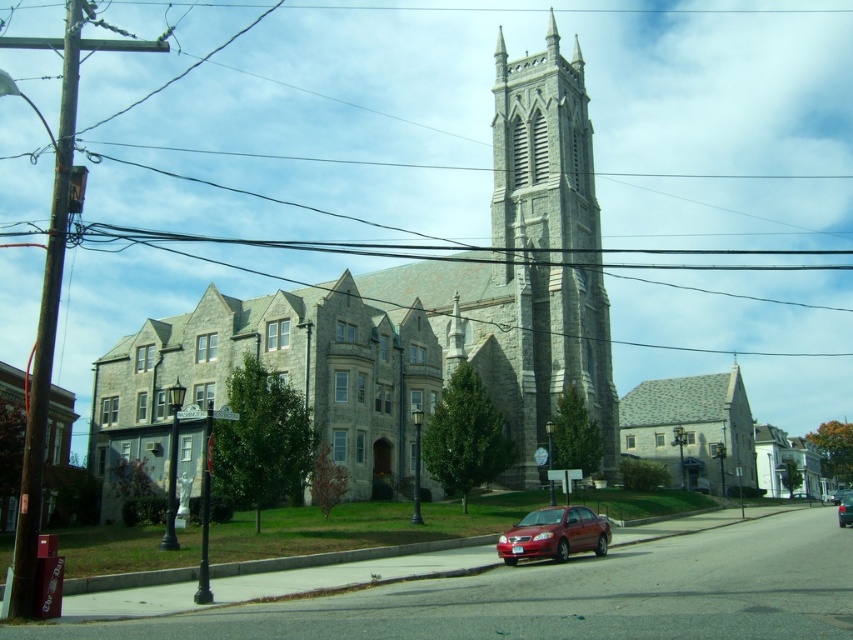
You are a pedestrian standing in front of the historic stone church with a tall spire. You see a shiny red sedan at center and a metallic red sedan at center. Which one is positioned higher relative to the other?

The shiny red sedan at center is located above the metallic red sedan at center, so it is positioned higher.